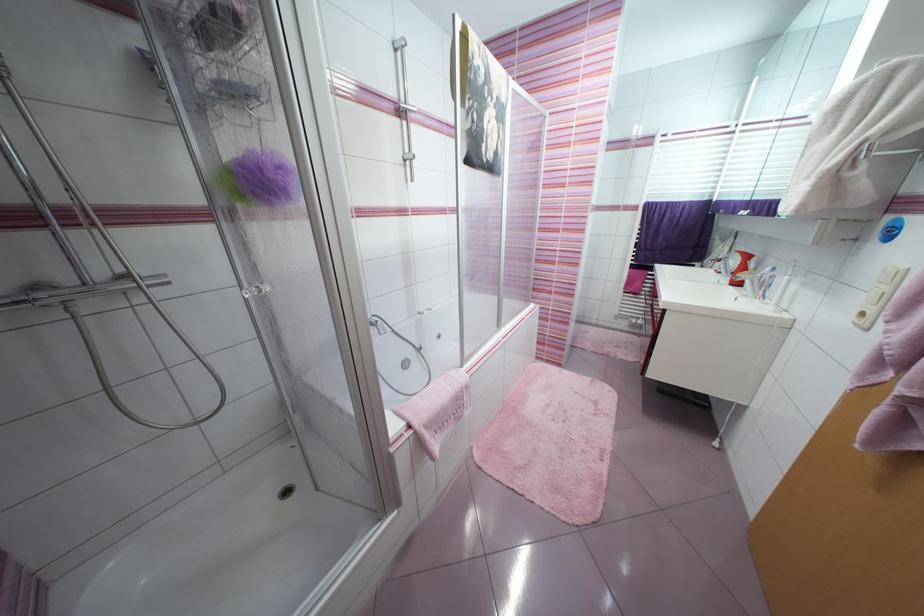
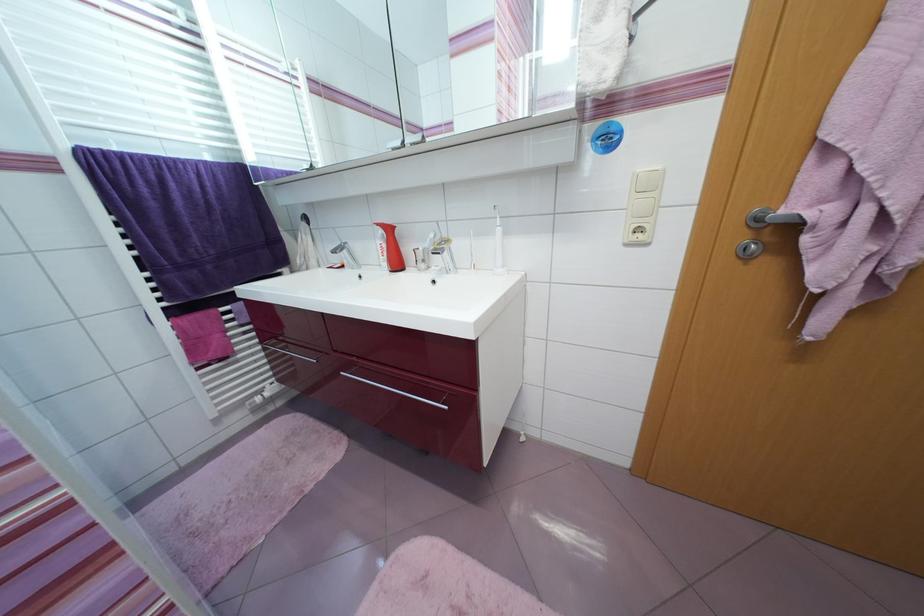
Find the pixel in the second image that matches pixel 752 257 in the first image.

(394, 231)